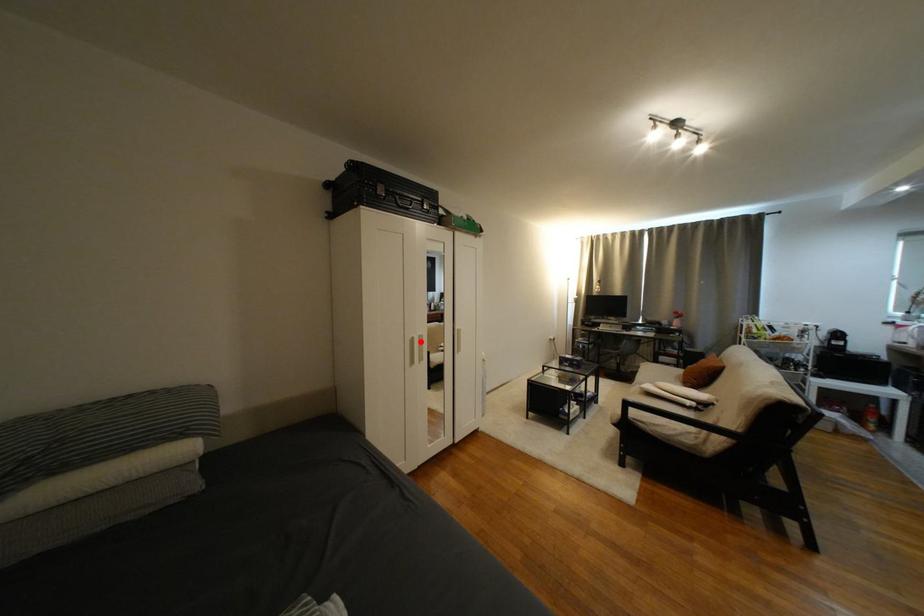
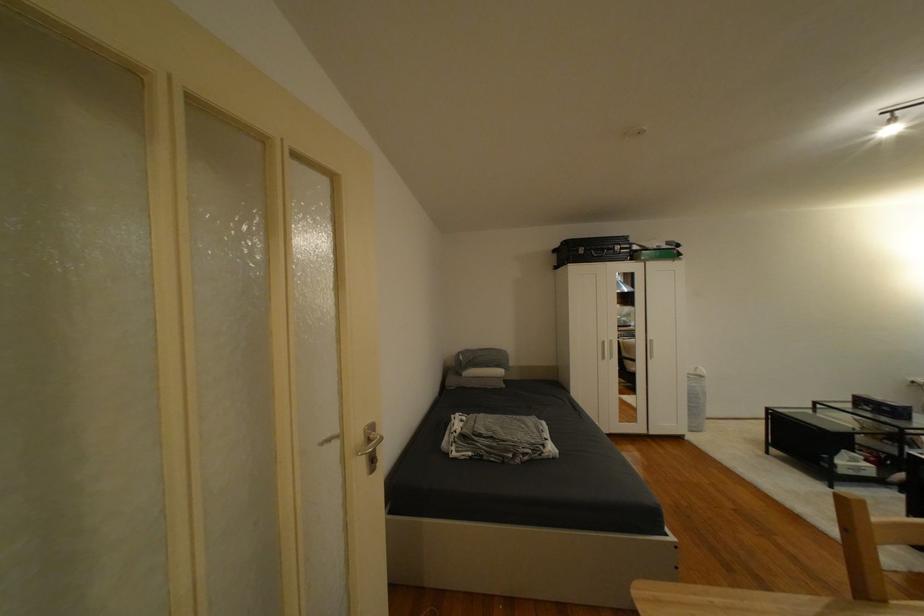
Question: I am providing you with two images of the same scene from different viewpoints. Image1 has a red point marked. In image2, the corresponding 3D location appears at what relative position? Reply with the corresponding letter.

Choices:
 (A) Closer
 (B) Farther

Answer: (B)